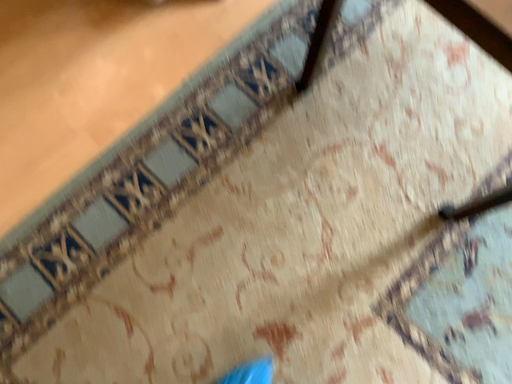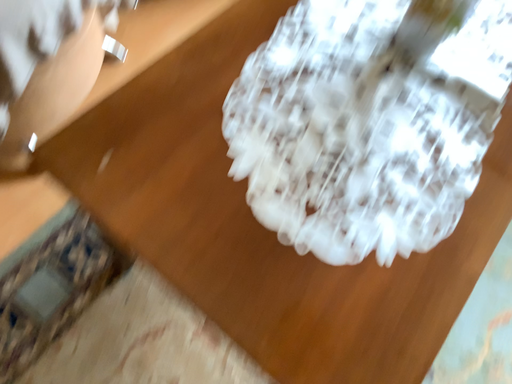
Question: Which way did the camera rotate in the video?

Choices:
 (A) rotated upward
 (B) rotated downward

Answer: (A)